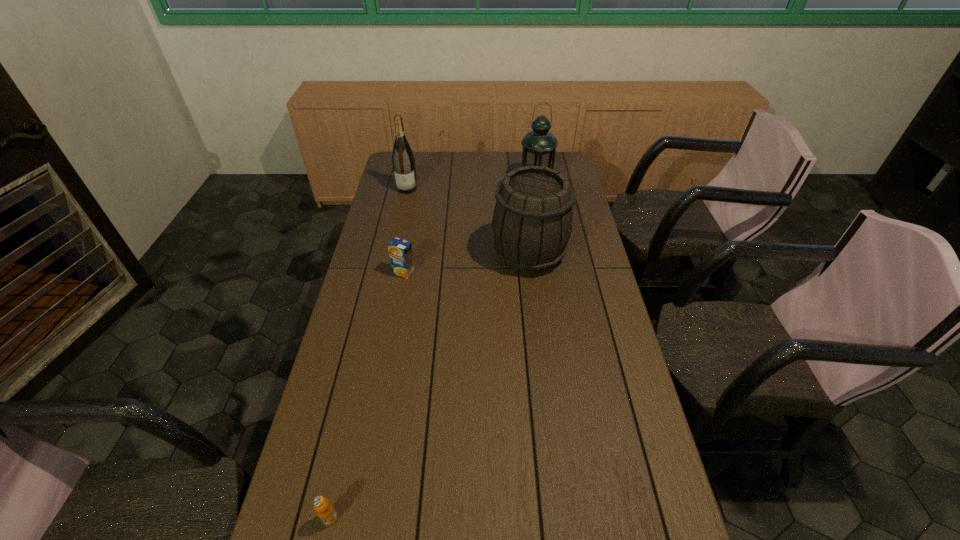
Locate an element on the screen. This screenshot has height=540, width=960. free point located on the right of the taller orange juice is located at coordinates (461, 273).

I want to click on object that is at the far edge, so click(x=539, y=146).

Find the location of a particular element. The height and width of the screenshot is (540, 960). wine bottle that is positioned at the left edge is located at coordinates (403, 161).

You are a GUI agent. You are given a task and a screenshot of the screen. Output one action in this format:
    pyautogui.click(x=<x>, y=<y>)
    Task: Click on the oil lamp situated at the right edge
    The width and height of the screenshot is (960, 540).
    Given the screenshot: What is the action you would take?
    pyautogui.click(x=539, y=146)

Locate an element on the screen. The width and height of the screenshot is (960, 540). wine bucket located at the right edge is located at coordinates (532, 222).

Locate an element on the screen. This screenshot has width=960, height=540. object present at the far right corner is located at coordinates (539, 146).

Where is `vacant space at the far edge of the desktop`? vacant space at the far edge of the desktop is located at coordinates (445, 153).

The height and width of the screenshot is (540, 960). Identify the location of vacant space at the left edge. (356, 484).

This screenshot has height=540, width=960. I want to click on free space at the right edge of the desktop, so (x=610, y=298).

Find the location of a particular element. Image resolution: width=960 pixels, height=540 pixels. free space that is in between the wine bottle and the wine bucket is located at coordinates (468, 221).